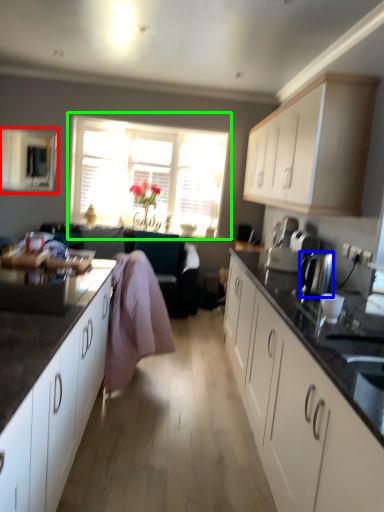
Question: Based on their relative distances, which object is farther from window screen (highlighted by a red box)? Choose from kitchen appliance (highlighted by a blue box) and window (highlighted by a green box).

Choices:
 (A) kitchen appliance
 (B) window

Answer: (A)